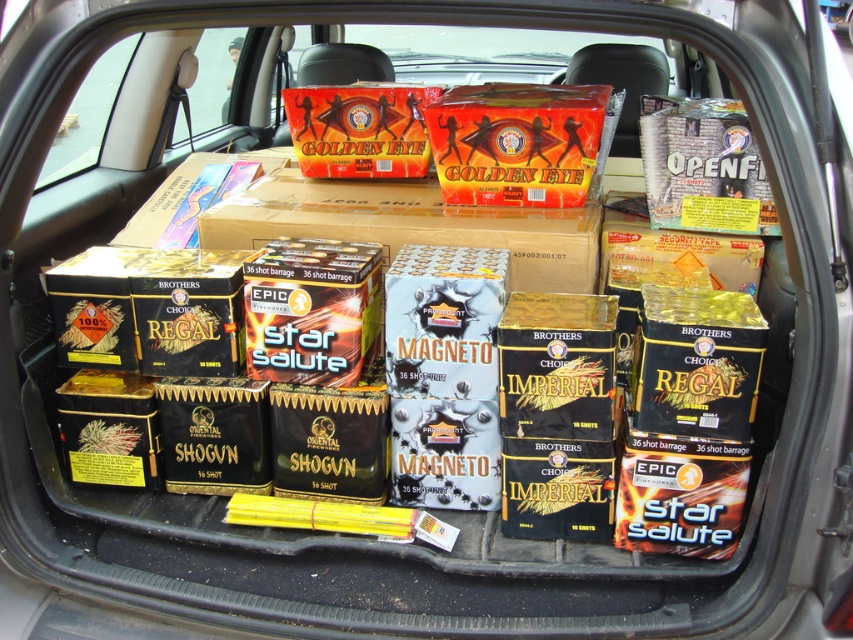
Which is in front, point (433, 154) or point (306, 102)?

Point (433, 154) is more forward.

Does orange matte box at center appear over shiny orange cardboard box at center?

No.

Does point (508, 125) lie in front of point (357, 154)?

Yes, point (508, 125) is in front of point (357, 154).

Find the location of a particular element. The image size is (853, 640). orange matte box at center is located at coordinates (515, 141).

This screenshot has height=640, width=853. Describe the element at coordinates (410, 225) in the screenshot. I see `orange cardboard box at center` at that location.

Can you confirm if orange cardboard box at center is shorter than shiny orange cardboard box at center?

No.

The width and height of the screenshot is (853, 640). I want to click on orange cardboard box at center, so click(x=410, y=225).

This screenshot has width=853, height=640. Describe the element at coordinates (410, 225) in the screenshot. I see `orange cardboard box at center` at that location.

Can you confirm if orange cardboard box at center is positioned below orange matte box at center?

Yes.

Between point (518, 266) and point (583, 116), which one is positioned in front?

Point (518, 266)

Image resolution: width=853 pixels, height=640 pixels. I want to click on orange cardboard box at center, so click(x=410, y=225).